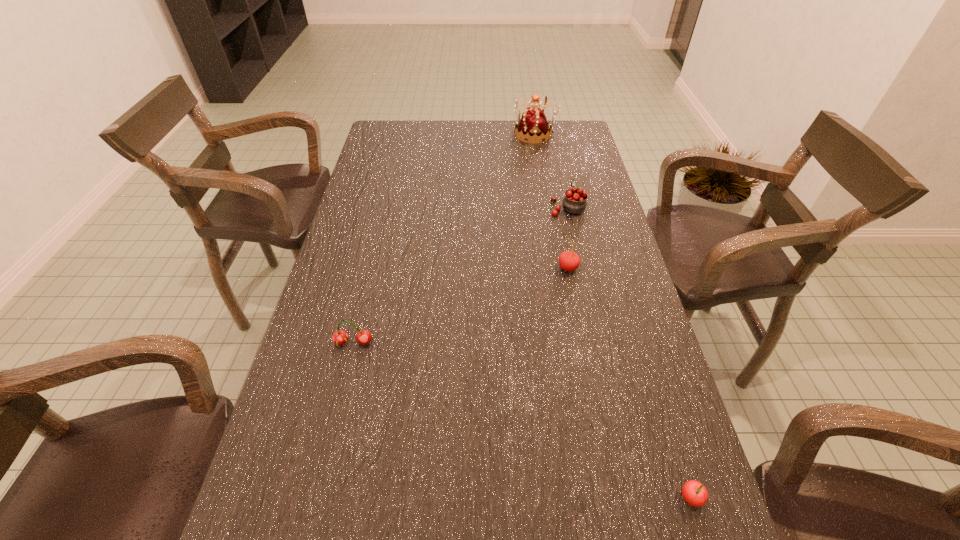
Locate an element on the screen. This screenshot has height=540, width=960. vacant space that's between the tiara and the nearest cherry is located at coordinates (612, 316).

At what (x,y) coordinates should I click in order to perform the action: click on free space between the leftmost cherry and the rightmost object. Please return your answer as a coordinate pair (x, y). Looking at the image, I should click on (521, 421).

The height and width of the screenshot is (540, 960). Find the location of `free space between the tallest object and the leftmost cherry`. free space between the tallest object and the leftmost cherry is located at coordinates (444, 238).

Where is `vacant region between the second nearest cherry and the fourth nearest object`? vacant region between the second nearest cherry and the fourth nearest object is located at coordinates (461, 275).

The image size is (960, 540). Identify the location of free space that is in between the rightmost cherry and the fourth farthest object. (521, 421).

This screenshot has width=960, height=540. I want to click on object that ranks as the fourth closest to the leftmost cherry, so click(x=533, y=124).

At what (x,y) coordinates should I click in order to perform the action: click on object that is the third nearest to the rightmost object. Please return your answer as a coordinate pair (x, y). Looking at the image, I should click on (574, 202).

I want to click on cherry object that ranks as the second closest to the second farthest cherry, so click(340, 337).

This screenshot has width=960, height=540. In order to click on cherry that can be found as the third closest to the third nearest object in this screenshot , I will do `click(694, 493)`.

Identify the location of vacant space that satisfies the following two spatial constraints: 1. with stems pointing upwards on the nearest cherry; 2. on the right side of the leftmost object. Image resolution: width=960 pixels, height=540 pixels. (316, 498).